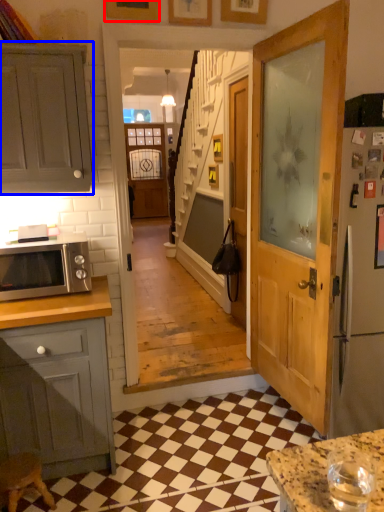
Question: Which of the following is the closest to the observer, picture frame (highlighted by a red box) or cabinetry (highlighted by a blue box)?

Choices:
 (A) picture frame
 (B) cabinetry

Answer: (B)